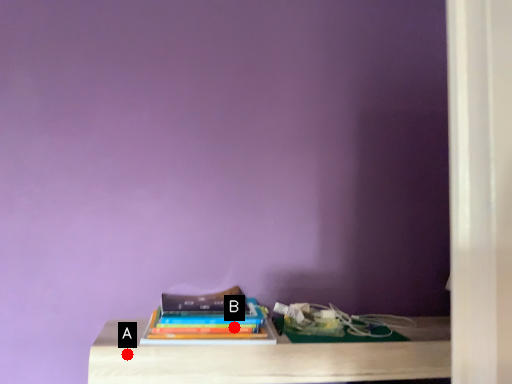
Question: Two points are circled on the image, labeled by A and B beside each circle. Which point is closer to the camera?

Choices:
 (A) A is closer
 (B) B is closer

Answer: (A)